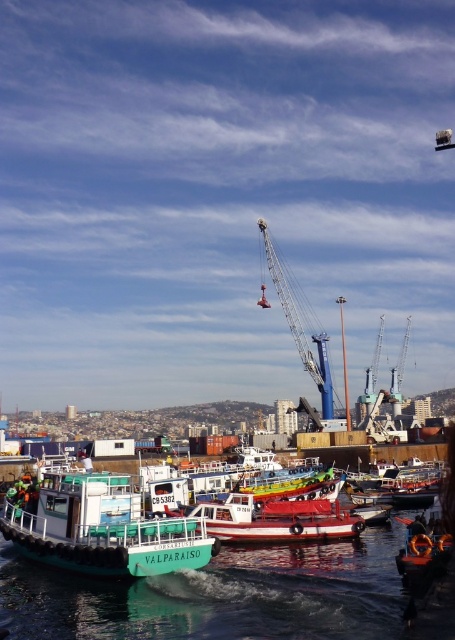
Between white glossy boat at center and blue metallic crane at center, which one is positioned lower?

white glossy boat at center

Which of these two, white glossy boat at center or blue metallic crane at center, stands shorter?

Standing shorter between the two is white glossy boat at center.

Where is `white glossy boat at center`? white glossy boat at center is located at coordinates (276, 518).

At what (x,y) coordinates should I click in order to perform the action: click on white glossy boat at center. Please return your answer as a coordinate pair (x, y). This screenshot has height=640, width=455. Looking at the image, I should click on (276, 518).

Is green matte boat at lower left positioned at the back of white glossy boat at center?

No, green matte boat at lower left is closer to the viewer.

Is green matte boat at lower left bigger than white glossy boat at center?

Indeed, green matte boat at lower left has a larger size compared to white glossy boat at center.

The height and width of the screenshot is (640, 455). I want to click on green matte boat at lower left, so click(x=100, y=525).

In the scene shown: Who is taller, green matte boat at lower left or blue metallic crane at center?

With more height is blue metallic crane at center.

Does green matte boat at lower left come in front of blue metallic crane at center?

Yes.

Does point (166, 541) come farther from viewer compared to point (329, 394)?

No, it is in front of (329, 394).

Find the location of `green matte boat at lower left`. green matte boat at lower left is located at coordinates (100, 525).